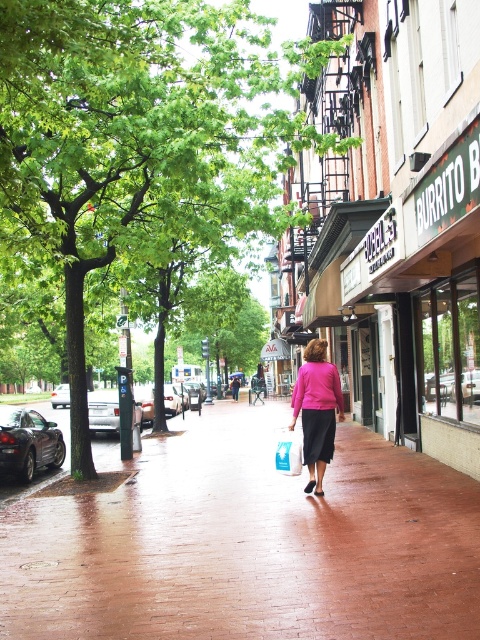
Question: Among these points, which one is nearest to the camera?

Choices:
 (A) (262, 452)
 (B) (205, 120)
 (C) (237, 394)
 (D) (310, 349)

Answer: (D)

Question: Does red brick sidewalk at center have a smaller size compared to pink matte skirt at center?

Choices:
 (A) yes
 (B) no

Answer: (B)

Question: Can you confirm if red brick sidewalk at center is smaller than green leafy tree at center?

Choices:
 (A) no
 (B) yes

Answer: (B)

Question: Does green leafy tree at center appear on the right side of pink matte sweater at center?

Choices:
 (A) no
 (B) yes

Answer: (B)

Question: Which of the following is the closest to the observer?

Choices:
 (A) (324, 547)
 (B) (321, 474)

Answer: (A)

Question: Which point is farther to the camera?

Choices:
 (A) coord(202,465)
 (B) coord(312,488)
 (C) coord(232,387)

Answer: (C)